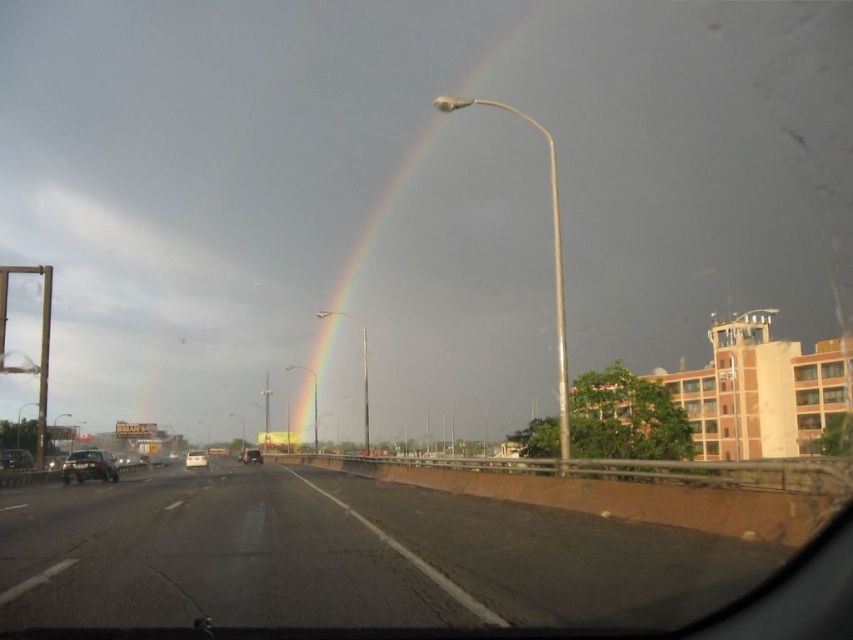
Question: Is matte black car at left to the right of shiny black sedan at left from the viewer's perspective?

Choices:
 (A) no
 (B) yes

Answer: (B)

Question: Which object is farther from the camera taking this photo?

Choices:
 (A) matte black car at left
 (B) metallic silver car at center

Answer: (B)

Question: Is rainbow at upper center below matte black car at left?

Choices:
 (A) no
 (B) yes

Answer: (A)

Question: Which object is positioned closest to the shiny black sedan at left?

Choices:
 (A) silver metallic sedan at center
 (B) matte black car at left

Answer: (B)

Question: Can you confirm if silver metallic sedan at center is positioned to the left of metallic silver car at center?

Choices:
 (A) no
 (B) yes

Answer: (B)

Question: Among these objects, which one is nearest to the camera?

Choices:
 (A) metallic silver car at center
 (B) silver metallic sedan at center

Answer: (B)